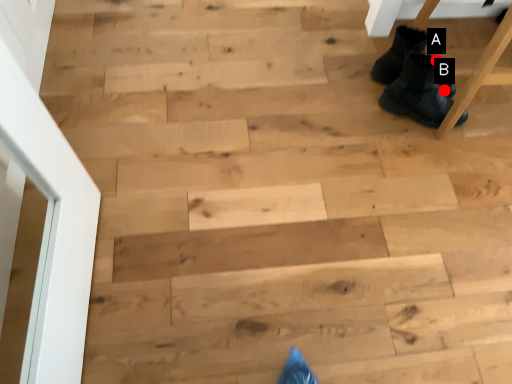
Question: Two points are circled on the image, labeled by A and B beside each circle. Which point is closer to the camera taking this photo?

Choices:
 (A) A is closer
 (B) B is closer

Answer: (A)